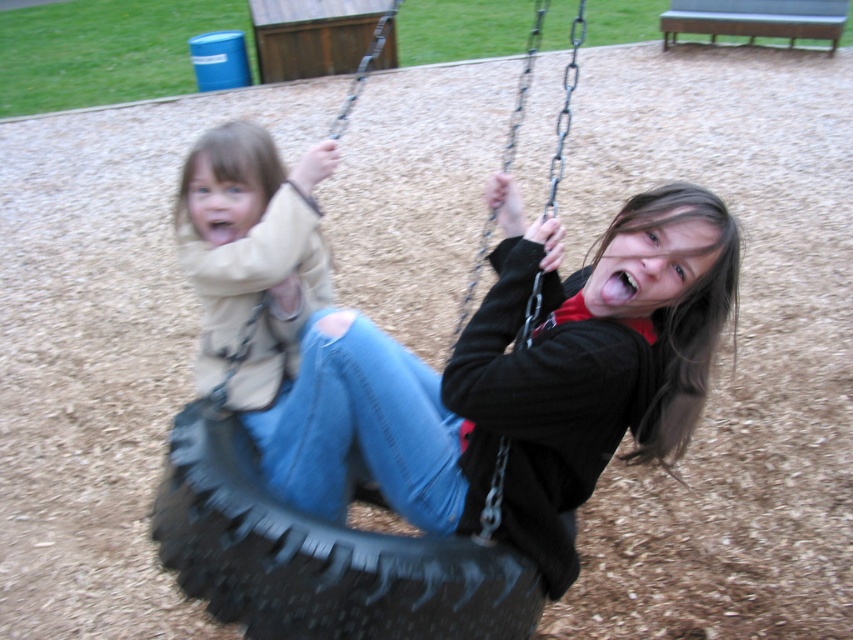
You are standing at the playground and see the black rubber tire at center and the metallic chain swing at center. Which object is positioned more to the left?

The black rubber tire at center is positioned more to the left than the metallic chain swing at center.

You are standing at the point marked by coordinates point (485, 372). You want to pick up a small toy that is exactly 2 meters away from you in a straight line. Is the blue trash bin in the background within reach of your 2 meter distance?

The blue trash bin in the background is not within reach because the point (485, 372) is 1.62 meters away from the viewer, so the distance to the blue trash bin would be greater than 2 meters.